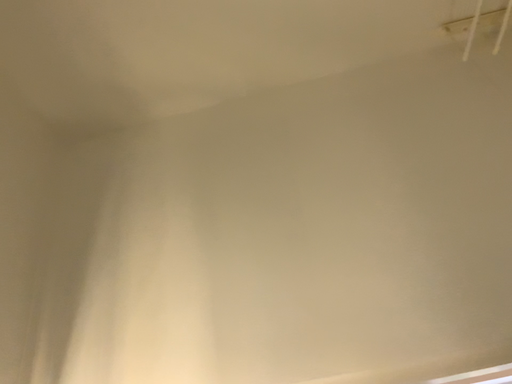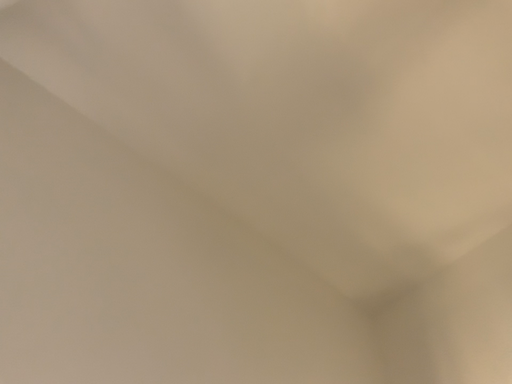
Question: Which way did the camera rotate in the video?

Choices:
 (A) rotated left
 (B) rotated right

Answer: (A)